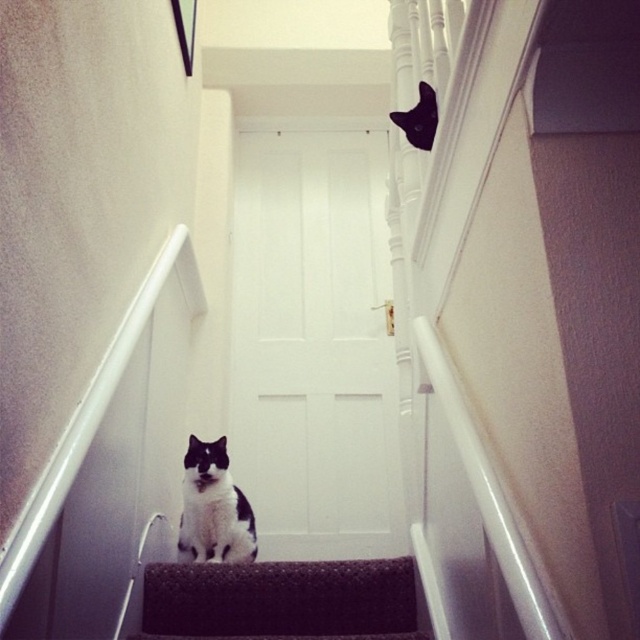
Question: Can you confirm if dark carpeted stair at center is bigger than black fur cat at upper center?

Choices:
 (A) yes
 (B) no

Answer: (A)

Question: Is dark carpeted stair at center above black and white fur cat at center?

Choices:
 (A) yes
 (B) no

Answer: (B)

Question: Which point is closer to the camera?

Choices:
 (A) (419, 125)
 (B) (330, 625)
 (C) (205, 497)

Answer: (B)

Question: Which of the following is the farthest from the observer?

Choices:
 (A) (428, 128)
 (B) (196, 442)
 (C) (214, 609)

Answer: (B)

Question: Can you confirm if dark carpeted stair at center is positioned to the right of black fur cat at upper center?

Choices:
 (A) no
 (B) yes

Answer: (A)

Question: Which point appears closest to the camera in this image?

Choices:
 (A) (204, 600)
 (B) (397, 115)
 (C) (252, 513)

Answer: (A)